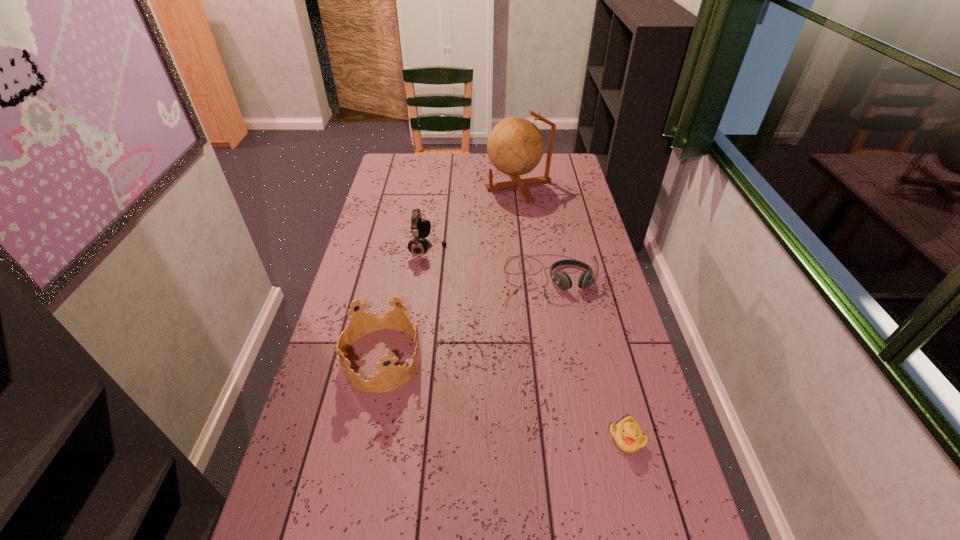
This screenshot has width=960, height=540. I want to click on the tallest object, so click(515, 146).

Locate an element on the screen. The width and height of the screenshot is (960, 540). the farthest object is located at coordinates (515, 146).

Where is `the left headset`? Image resolution: width=960 pixels, height=540 pixels. the left headset is located at coordinates (420, 228).

Where is `the second nearest object`? The height and width of the screenshot is (540, 960). the second nearest object is located at coordinates (391, 377).

The image size is (960, 540). Find the location of `the right headset`. the right headset is located at coordinates (562, 279).

The height and width of the screenshot is (540, 960). Find the location of `the fourth tallest object`. the fourth tallest object is located at coordinates (562, 279).

Locate an element on the screen. the nearest object is located at coordinates click(627, 434).

You are a GUI agent. You are given a task and a screenshot of the screen. Output one action in this format:
    pyautogui.click(x=<x>, y=<y>)
    Task: Click on the shortest object
    Image resolution: width=960 pixels, height=540 pixels.
    Given the screenshot: What is the action you would take?
    pyautogui.click(x=627, y=434)

You are a GUI agent. You are given a task and a screenshot of the screen. Output one action in this format:
    pyautogui.click(x=<x>, y=<y>)
    Task: Click on the vacant space located 0.210m on the surface of the farthest object
    
    Given the screenshot: What is the action you would take?
    pyautogui.click(x=438, y=185)

This screenshot has width=960, height=540. I want to click on free space located on the surface of the farthest object, so click(x=418, y=185).